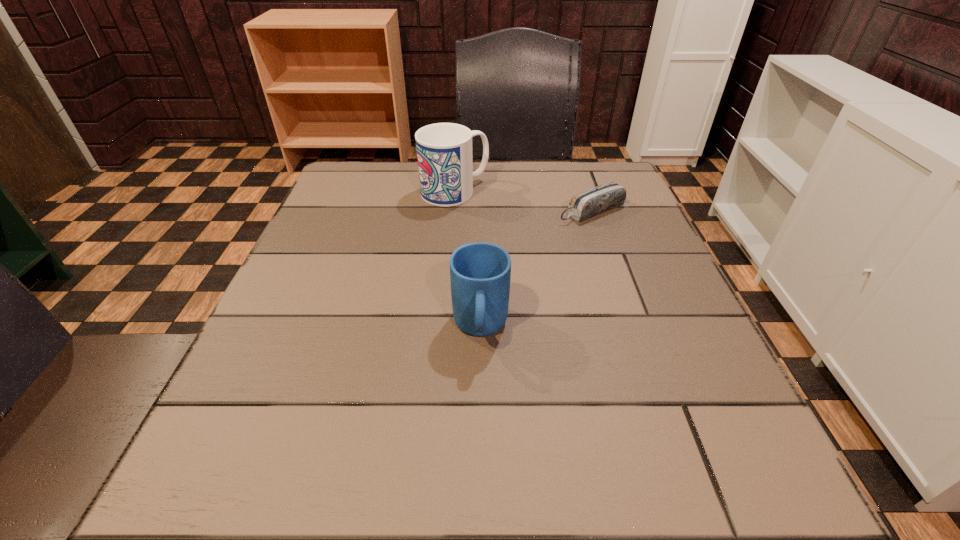
Locate an element on the screen. The height and width of the screenshot is (540, 960). vacant space that is in between the nearer mug and the shortest object is located at coordinates (536, 269).

Find the location of a particular element. The image size is (960, 540). unoccupied position between the nearer mug and the pencil box is located at coordinates (536, 269).

Image resolution: width=960 pixels, height=540 pixels. Find the location of `free space between the second shortest object and the rightmost object`. free space between the second shortest object and the rightmost object is located at coordinates (536, 269).

You are a GUI agent. You are given a task and a screenshot of the screen. Output one action in this format:
    pyautogui.click(x=<x>, y=<y>)
    Task: Click on the object that is the closest to the rightmost object
    This screenshot has width=960, height=540.
    Given the screenshot: What is the action you would take?
    pyautogui.click(x=444, y=150)

I want to click on the second closest object relative to the farther mug, so click(x=480, y=273).

The image size is (960, 540). Identify the location of free point that satisfies the following two spatial constraints: 1. on the front side of the pencil box; 2. on the right side of the farther mug. (453, 211).

Where is `blank area in the image that satisfies the following two spatial constraints: 1. on the front side of the farther mug; 2. on the left side of the rightmost object`? blank area in the image that satisfies the following two spatial constraints: 1. on the front side of the farther mug; 2. on the left side of the rightmost object is located at coordinates (453, 211).